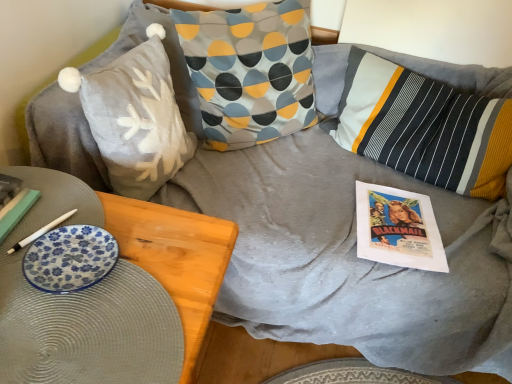
At what (x,y) coordinates should I click in order to perform the action: click on vacant area located to the right-hand side of matte paper magazine at lower left. Please return your answer as a coordinate pair (x, y). Looking at the image, I should click on (86, 224).